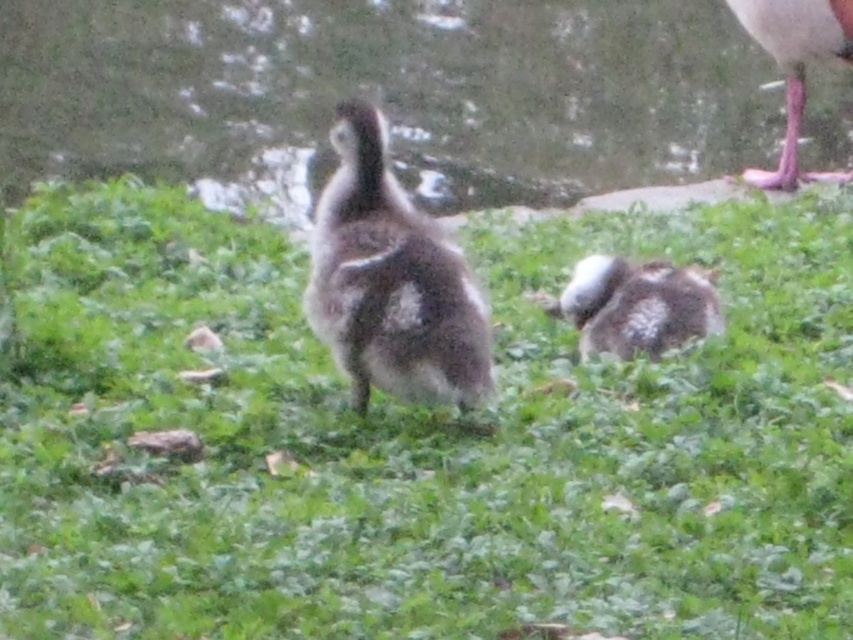
Can you confirm if green fuzzy grass at center is smaller than pink rubber duck at upper right?

No.

This screenshot has height=640, width=853. I want to click on green fuzzy grass at center, so click(418, 442).

Does green fuzzy grass at center appear under green grassy area at center?

Yes, green fuzzy grass at center is below green grassy area at center.

Can you confirm if green fuzzy grass at center is wider than green grassy area at center?

In fact, green fuzzy grass at center might be narrower than green grassy area at center.

This screenshot has height=640, width=853. Find the location of `green fuzzy grass at center`. green fuzzy grass at center is located at coordinates (418, 442).

Between speckled feathered duckling at center and pink rubber duck at upper right, which one appears on the right side from the viewer's perspective?

Positioned to the right is pink rubber duck at upper right.

Is point (674, 337) in front of point (846, 180)?

Yes, point (674, 337) is closer to viewer.

What do you see at coordinates (637, 305) in the screenshot?
I see `speckled feathered duckling at center` at bounding box center [637, 305].

This screenshot has height=640, width=853. In order to click on speckled feathered duckling at center in this screenshot , I will do `click(637, 305)`.